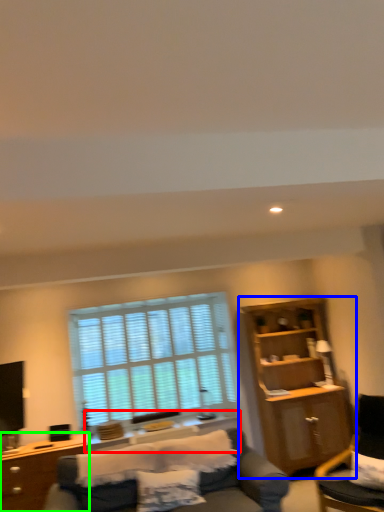
Question: Which object is the closest to the side table (highlighted by a red box)? Choose among these: cabinetry (highlighted by a blue box) or desk (highlighted by a green box).

Choices:
 (A) cabinetry
 (B) desk

Answer: (B)